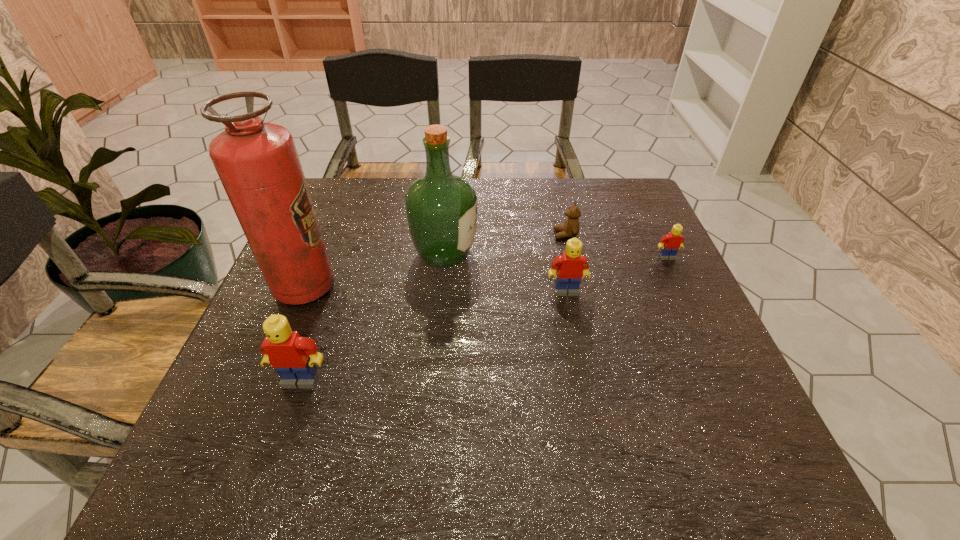
Please mark a free spot for a new Lego to balance the arrangement. Please provide its 2D coordinates. Your answer should be formatted as a tuple, i.e. [(x, y)], where the tuple contains the x and y coordinates of a point satisfying the conditions above.

[(446, 332)]